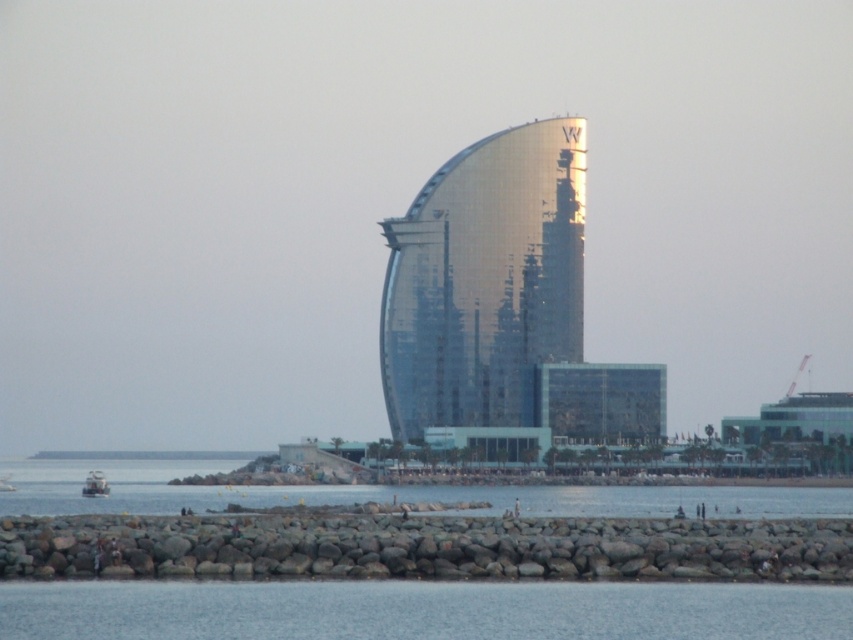
Can you confirm if glossy glass tower at center is taller than transparent water at lower center?

Yes, glossy glass tower at center is taller than transparent water at lower center.

Consider the image. Who is more distant from viewer, (x=489, y=164) or (x=500, y=612)?

The point (x=489, y=164) is behind.

Where is `glossy glass tower at center`? The height and width of the screenshot is (640, 853). glossy glass tower at center is located at coordinates (485, 280).

Identify the location of rocky shore at lower center. This screenshot has height=640, width=853. (424, 547).

What do you see at coordinates (424, 547) in the screenshot?
I see `rocky shore at lower center` at bounding box center [424, 547].

Identify the location of rocky shore at lower center. (424, 547).

Can you confirm if glossy glass tower at center is taller than rocky shore at lower center?

Yes.

Can you confirm if glossy glass tower at center is positioned to the right of rocky shore at lower center?

Correct, you'll find glossy glass tower at center to the right of rocky shore at lower center.

Find the location of `glossy glass tower at center`. glossy glass tower at center is located at coordinates (485, 280).

Identify the location of glossy glass tower at center. (485, 280).